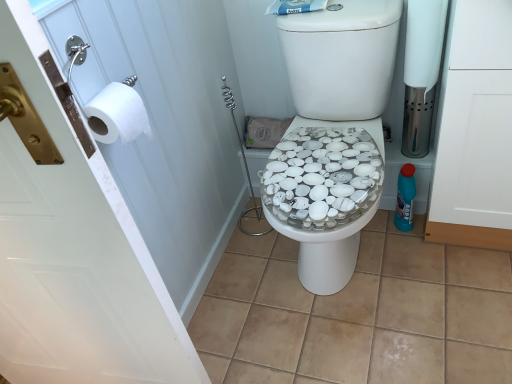
Question: Considering the relative sizes of blue plastic bottle at right and white matte toilet paper at left, the 2th toilet paper viewed from the right, in the image provided, is blue plastic bottle at right thinner than white matte toilet paper at left, the 2th toilet paper viewed from the right,?

Choices:
 (A) no
 (B) yes

Answer: (A)

Question: Is blue plastic bottle at right smaller than white matte toilet paper at left, the second toilet paper in the top-to-bottom sequence?

Choices:
 (A) no
 (B) yes

Answer: (A)

Question: Is blue plastic bottle at right closer to camera compared to white matte toilet paper at left, placed as the second toilet paper when sorted from back to front?

Choices:
 (A) yes
 (B) no

Answer: (B)

Question: From the image's perspective, is blue plastic bottle at right over white matte toilet paper at left, acting as the 1th toilet paper starting from the bottom?

Choices:
 (A) yes
 (B) no

Answer: (B)

Question: Would you say blue plastic bottle at right is a long distance from white matte toilet paper at left, which ranks as the 1th toilet paper in left-to-right order?

Choices:
 (A) no
 (B) yes

Answer: (A)

Question: Does point (439, 24) appear closer or farther from the camera than point (396, 196)?

Choices:
 (A) farther
 (B) closer

Answer: (B)

Question: From the image's perspective, relative to blue plastic bottle at right, is white matte toilet paper at right, acting as the 1th toilet paper starting from the right, above or below?

Choices:
 (A) above
 (B) below

Answer: (A)

Question: In the image, is white matte toilet paper at right, acting as the 1th toilet paper starting from the top, on the left side or the right side of blue plastic bottle at right?

Choices:
 (A) left
 (B) right

Answer: (A)

Question: In terms of size, does white matte toilet paper at right, positioned as the second toilet paper in left-to-right order, appear bigger or smaller than blue plastic bottle at right?

Choices:
 (A) big
 (B) small

Answer: (A)

Question: From their relative heights in the image, would you say beige tile at center is taller or shorter than blue plastic bottle at right?

Choices:
 (A) short
 (B) tall

Answer: (A)

Question: Looking at their shapes, would you say beige tile at center is wider or thinner than blue plastic bottle at right?

Choices:
 (A) wide
 (B) thin

Answer: (A)

Question: Considering the relative positions of beige tile at center and blue plastic bottle at right in the image provided, is beige tile at center to the left or to the right of blue plastic bottle at right?

Choices:
 (A) right
 (B) left

Answer: (B)

Question: Considering the positions of beige tile at center and blue plastic bottle at right in the image, is beige tile at center bigger or smaller than blue plastic bottle at right?

Choices:
 (A) big
 (B) small

Answer: (A)

Question: Is point click(184, 48) positioned closer to the camera than point click(402, 203)?

Choices:
 (A) closer
 (B) farther

Answer: (A)

Question: Choose the correct answer: Is white paper at left, which appears as the second screen door when viewed from the right, inside blue plastic bottle at right or outside it?

Choices:
 (A) inside
 (B) outside

Answer: (B)